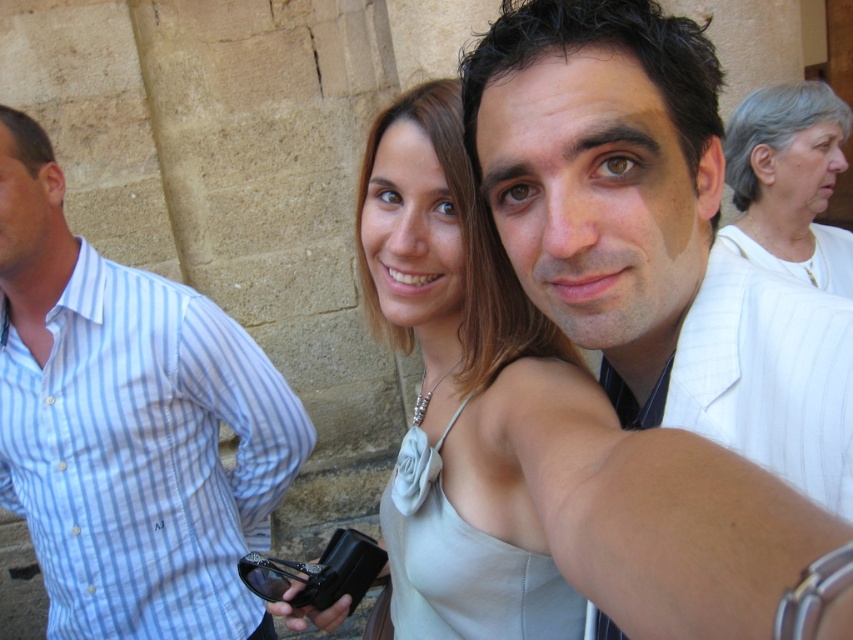
Question: Does white textured shirt at center appear on the left side of white fabric at upper right?

Choices:
 (A) yes
 (B) no

Answer: (A)

Question: Is white textured shirt at center positioned before blue striped shirt at left?

Choices:
 (A) no
 (B) yes

Answer: (B)

Question: Among these points, which one is farthest from the camera?

Choices:
 (A) (373, 560)
 (B) (77, 328)
 (C) (795, 120)

Answer: (C)

Question: Among these objects, which one is nearest to the camera?

Choices:
 (A) white fabric at upper right
 (B) blue striped shirt at left
 (C) white textured shirt at center

Answer: (C)

Question: Which of the following is the farthest from the observer?

Choices:
 (A) (350, 534)
 (B) (9, 438)
 (C) (715, 413)
 (D) (817, 160)

Answer: (D)

Question: Is white textured shirt at center wider than black plastic camera at center?

Choices:
 (A) yes
 (B) no

Answer: (A)